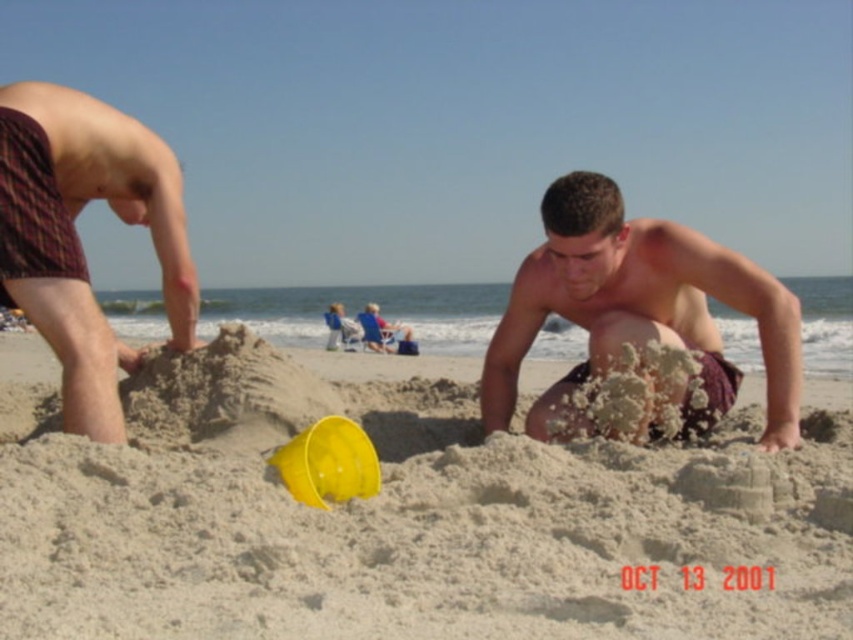
Question: Does smooth tan skin at center appear over plaid fabric shorts at left?

Choices:
 (A) yes
 (B) no

Answer: (B)

Question: Which point is closer to the camera?

Choices:
 (A) (10, 221)
 (B) (99, 522)
 (C) (784, 369)

Answer: (B)

Question: Which object is positioned closest to the plaid fabric shorts at left?

Choices:
 (A) smooth tan skin at center
 (B) beige sand at center

Answer: (A)

Question: Can you confirm if beige sand at center is thinner than smooth tan skin at center?

Choices:
 (A) no
 (B) yes

Answer: (B)

Question: Is beige sand at center thinner than smooth tan skin at center?

Choices:
 (A) yes
 (B) no

Answer: (A)

Question: Which of the following is the closest to the observer?

Choices:
 (A) (619, 292)
 (B) (73, 356)

Answer: (B)